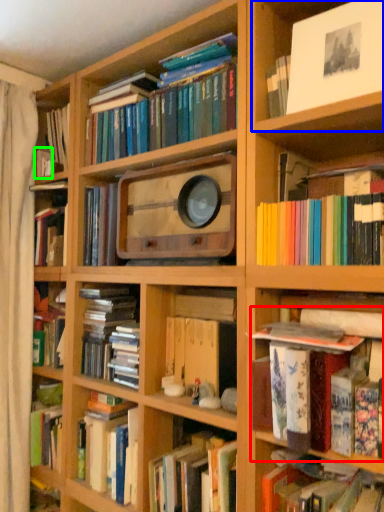
Question: Which object is the closest to the book (highlighted by a red box)? Choose among these: cabinet (highlighted by a blue box) or book (highlighted by a green box).

Choices:
 (A) cabinet
 (B) book

Answer: (A)